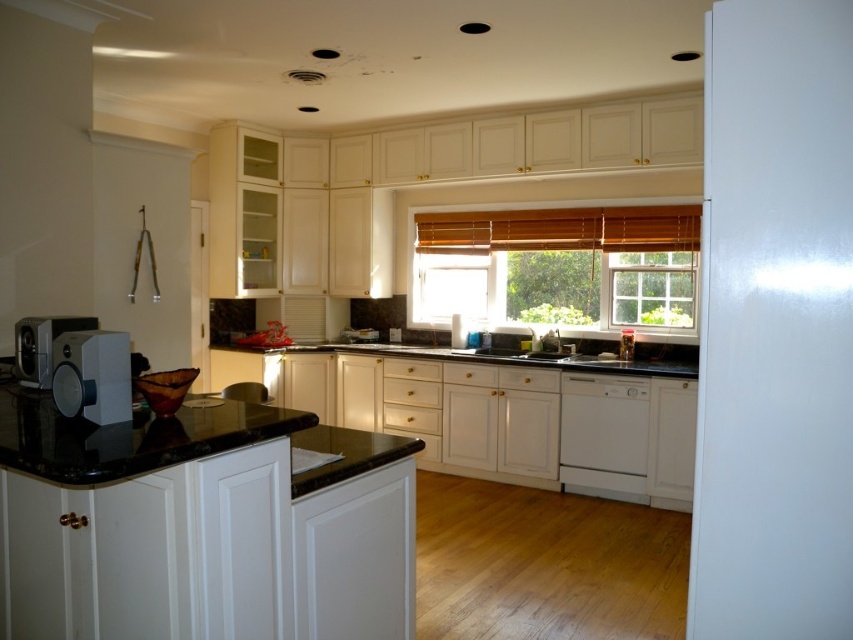
Between satin white toaster at left and white glossy sink at center, which one appears on the right side from the viewer's perspective?

white glossy sink at center is more to the right.

The width and height of the screenshot is (853, 640). Describe the element at coordinates (91, 376) in the screenshot. I see `satin white toaster at left` at that location.

You are a GUI agent. You are given a task and a screenshot of the screen. Output one action in this format:
    pyautogui.click(x=<x>, y=<y>)
    Task: Click on the satin white toaster at left
    This screenshot has height=640, width=853.
    Given the screenshot: What is the action you would take?
    pyautogui.click(x=91, y=376)

Who is taller, satin white toaster at left or matte silver speaker at left?

satin white toaster at left

Who is lower down, satin white toaster at left or matte silver speaker at left?

satin white toaster at left

Where is `satin white toaster at left`? satin white toaster at left is located at coordinates (91, 376).

Find the location of a particular element. The width and height of the screenshot is (853, 640). satin white toaster at left is located at coordinates (91, 376).

In the scene shown: Is matte silver speaker at left shorter than white glossy sink at center?

No, matte silver speaker at left is not shorter than white glossy sink at center.

Between point (41, 360) and point (508, 349), which one is positioned behind?

Point (508, 349)

Who is more forward, (39, 330) or (489, 348)?

Point (39, 330) is in front.

Locate an element on the screen. The height and width of the screenshot is (640, 853). matte silver speaker at left is located at coordinates (42, 346).